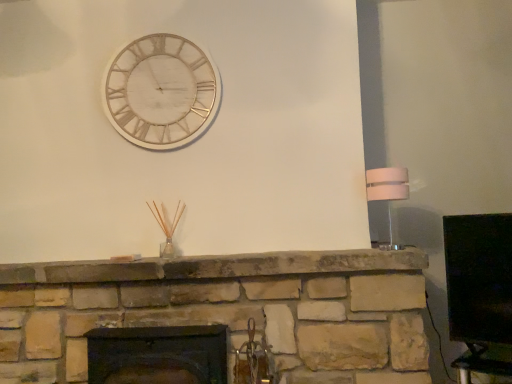
Question: Is white marble clock at upper center located outside dark brown wood fireplace at center?

Choices:
 (A) yes
 (B) no

Answer: (A)

Question: Does white marble clock at upper center appear on the left side of dark brown wood fireplace at center?

Choices:
 (A) no
 (B) yes

Answer: (B)

Question: Is white marble clock at upper center taller than dark brown wood fireplace at center?

Choices:
 (A) yes
 (B) no

Answer: (A)

Question: From a real-world perspective, is white marble clock at upper center physically above dark brown wood fireplace at center?

Choices:
 (A) yes
 (B) no

Answer: (A)

Question: Considering the relative sizes of white marble clock at upper center and dark brown wood fireplace at center in the image provided, is white marble clock at upper center wider than dark brown wood fireplace at center?

Choices:
 (A) yes
 (B) no

Answer: (B)

Question: Is white marble clock at upper center inside or outside of white glossy lampshade at right?

Choices:
 (A) outside
 (B) inside

Answer: (A)

Question: Is white marble clock at upper center to the left or to the right of white glossy lampshade at right in the image?

Choices:
 (A) left
 (B) right

Answer: (A)

Question: Is white marble clock at upper center taller or shorter than white glossy lampshade at right?

Choices:
 (A) short
 (B) tall

Answer: (B)

Question: From the image's perspective, is white marble clock at upper center located above or below white glossy lampshade at right?

Choices:
 (A) below
 (B) above

Answer: (B)

Question: In terms of width, does white glossy lampshade at right look wider or thinner when compared to dark brown wood fireplace at center?

Choices:
 (A) thin
 (B) wide

Answer: (A)

Question: Is white glossy lampshade at right bigger or smaller than dark brown wood fireplace at center?

Choices:
 (A) small
 (B) big

Answer: (A)

Question: From the image's perspective, relative to dark brown wood fireplace at center, is white glossy lampshade at right above or below?

Choices:
 (A) above
 (B) below

Answer: (A)

Question: Relative to dark brown wood fireplace at center, is white glossy lampshade at right in front or behind?

Choices:
 (A) front
 (B) behind

Answer: (B)

Question: Relative to white marble clock at upper center, is white glossy lampshade at right in front or behind?

Choices:
 (A) front
 (B) behind

Answer: (A)

Question: Considering the positions of white glossy lampshade at right and white marble clock at upper center in the image, is white glossy lampshade at right wider or thinner than white marble clock at upper center?

Choices:
 (A) wide
 (B) thin

Answer: (A)